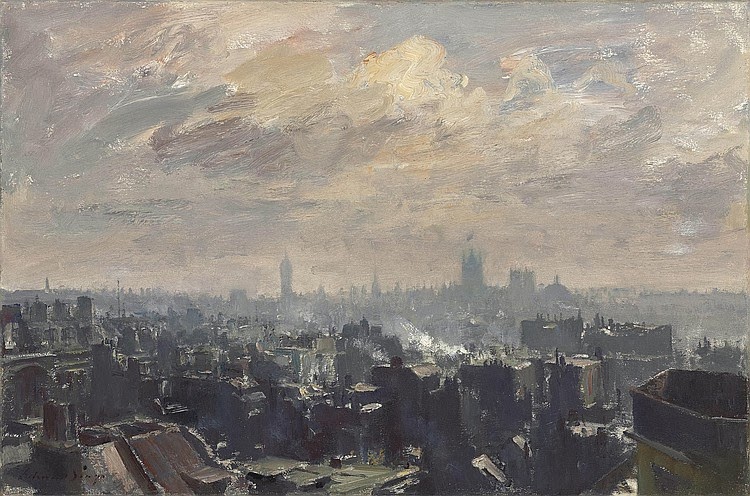
Where is `canvas`? canvas is located at coordinates (451, 213).